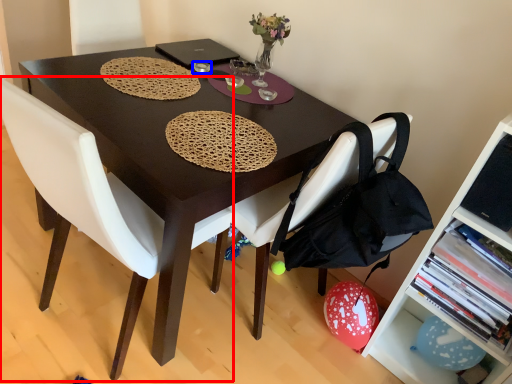
Question: Which of the following is the farthest to the observer, chair (highlighted by a red box) or tableware (highlighted by a blue box)?

Choices:
 (A) chair
 (B) tableware

Answer: (B)